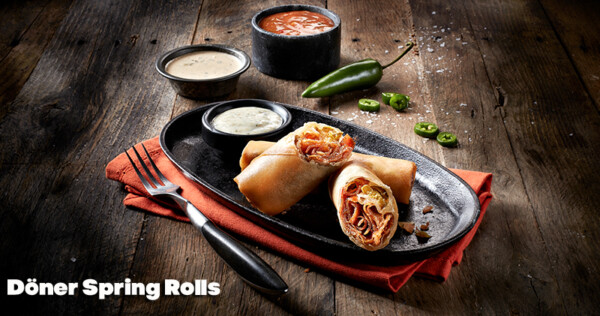
The height and width of the screenshot is (316, 600). I want to click on serviette, so click(x=211, y=208).